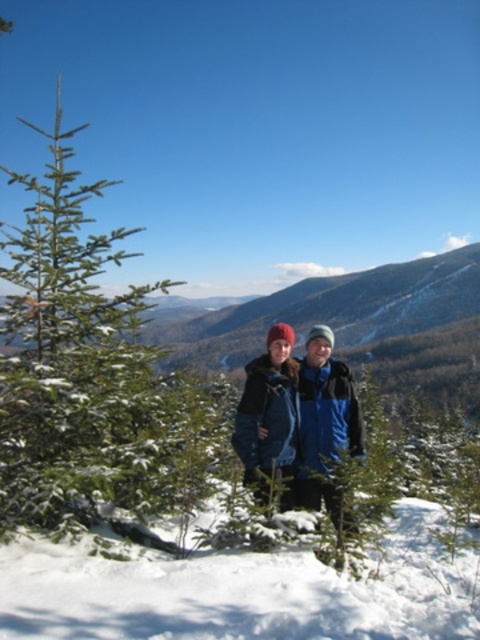
You are standing in the snowy landscape and want to move from the green textured pine tree at left to the blue woolen jacket at center. Which direction should you move to reach the jacket?

The green textured pine tree at left is to the left of the blue woolen jacket at center. To reach the jacket, you should move to the right from the pine tree.

You are navigating through the snowy landscape and need to reach a specific location. You have two points marked on your map labeled as point 1 and point 2. Point 1 is located at coordinates point (72, 628) and point 2 is at point (295, 401). Based on the image provided, which point is closer to you?

Point (72, 628) is closer to the viewer than point (295, 401), so point 1 is closer to you.